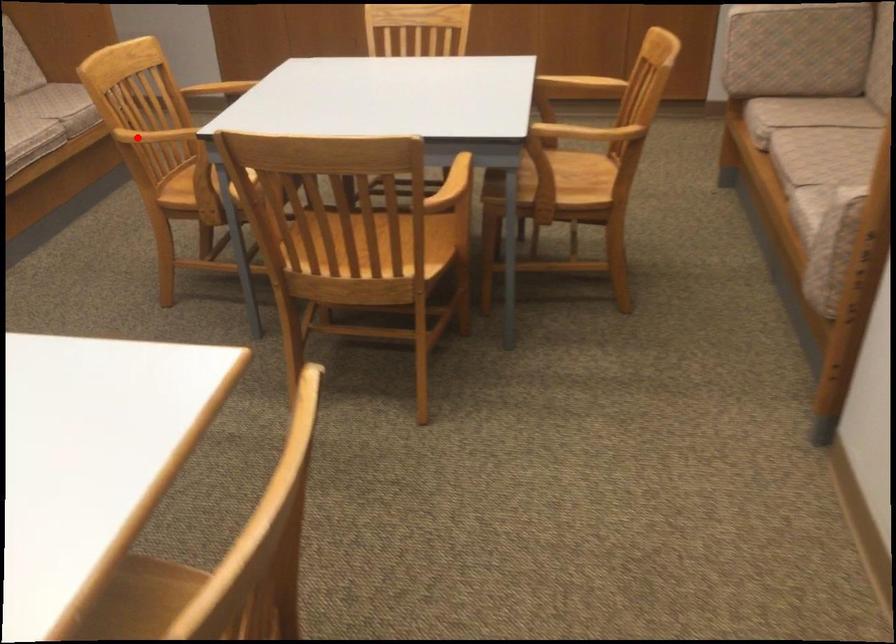
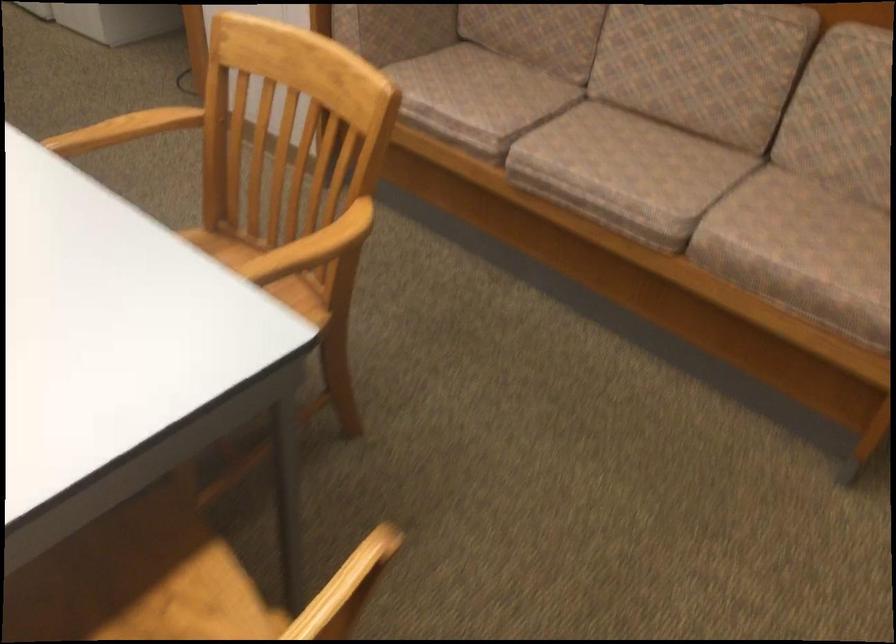
Question: I am providing you with two images of the same scene from different viewpoints. In image1, a red point is highlighted. Considering the same 3D point in image2, which of the following is correct?

Choices:
 (A) It is closer
 (B) It is farther

Answer: (A)